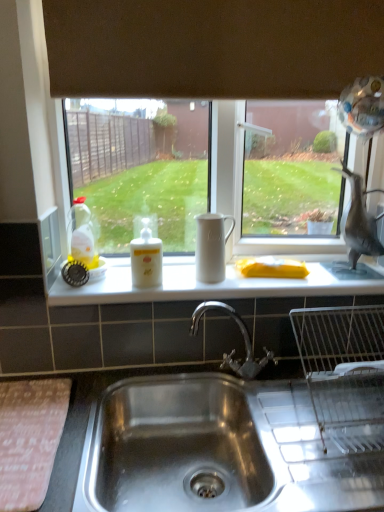
The image size is (384, 512). I want to click on gray matte bird at right, so point(358,221).

Measure the distance between point (353, 227) and camera.

A distance of 1.34 meters exists between point (353, 227) and camera.

This screenshot has width=384, height=512. Describe the element at coordinates (218, 450) in the screenshot. I see `stainless steel sink at lower center` at that location.

Where is `white matte jug at center`? Image resolution: width=384 pixels, height=512 pixels. white matte jug at center is located at coordinates (211, 247).

Would you say gray matte bird at right is inside or outside translucent yellow liquid at bottle left, the 1th bottle viewed from the left?

The correct answer is: outside.

Is gray matte bird at right in contact with translucent yellow liquid at bottle left, the 1th bottle viewed from the left?

There is a gap between gray matte bird at right and translucent yellow liquid at bottle left, the 1th bottle viewed from the left.

Does point (342, 217) appear closer or farther from the camera than point (88, 208)?

Point (342, 217) appears to be closer to the viewer than point (88, 208).

From a real-world perspective, who is located lower, brown matte exhaust hood at upper center or white matte jug at center?

In real-world perspective, white matte jug at center is lower.

Can you confirm if brown matte exhaust hood at upper center is positioned to the left of white matte jug at center?

In fact, brown matte exhaust hood at upper center is to the right of white matte jug at center.

Is brown matte exhaust hood at upper center completely or partially outside of white matte jug at center?

Indeed, brown matte exhaust hood at upper center is completely outside white matte jug at center.

In the image, there is a white matte jug at center. Find the location of `sink below it (from a real-world perspective)`. sink below it (from a real-world perspective) is located at coordinates (218, 450).

Would you say white matte jug at center is part of stainless steel sink at lower center's contents?

No, white matte jug at center is located outside of stainless steel sink at lower center.

Is stainless steel sink at lower center taller or shorter than white matte jug at center?

In the image, stainless steel sink at lower center appears to be taller than white matte jug at center.

From a real-world perspective, between stainless steel sink at lower center and white matte jug at center, who is vertically higher?

white matte jug at center is physically above.

Is there a large distance between translucent yellow liquid at bottle left, the 1th bottle viewed from the left, and gray matte bird at right?

No, there isn't a large distance between translucent yellow liquid at bottle left, the 1th bottle viewed from the left, and gray matte bird at right.

What are the coordinates of `animal above the translucent yellow liquid at bottle left, the 1th bottle viewed from the left (from the image's perspective)` in the screenshot? It's located at (358, 221).

Is translucent yellow liquid at bottle left, the 1th bottle viewed from the left, inside the boundaries of gray matte bird at right, or outside?

translucent yellow liquid at bottle left, the 1th bottle viewed from the left, is located beyond the bounds of gray matte bird at right.

From the image's perspective, is translucent yellow liquid at bottle left, arranged as the second bottle when viewed from the right, over white matte counter top at center?

Yes, from the image's perspective, translucent yellow liquid at bottle left, arranged as the second bottle when viewed from the right, is above white matte counter top at center.

Can you tell me how much translucent yellow liquid at bottle left, arranged as the second bottle when viewed from the right, and white matte counter top at center differ in facing direction?

The angular difference between translucent yellow liquid at bottle left, arranged as the second bottle when viewed from the right, and white matte counter top at center is 0.337 degrees.

This screenshot has height=512, width=384. I want to click on counter top on the right of translucent yellow liquid at bottle left, the 1th bottle viewed from the left, so click(x=218, y=284).

Considering the relative positions of brown matte exhaust hood at upper center and stainless steel sink at lower center in the image provided, is brown matte exhaust hood at upper center to the left of stainless steel sink at lower center from the viewer's perspective?

Yes.

Is brown matte exhaust hood at upper center wider or thinner than stainless steel sink at lower center?

In the image, brown matte exhaust hood at upper center appears to be more narrow than stainless steel sink at lower center.

Based on the photo, from the image's perspective, which object appears higher, brown matte exhaust hood at upper center or stainless steel sink at lower center?

brown matte exhaust hood at upper center is shown above in the image.

From a real-world perspective, is brown matte exhaust hood at upper center physically located above or below stainless steel sink at lower center?

In terms of real-world spatial position, brown matte exhaust hood at upper center is above stainless steel sink at lower center.

Is translucent yellow liquid at bottle left, the 1th bottle viewed from the left, facing away from brown matte exhaust hood at upper center?

translucent yellow liquid at bottle left, the 1th bottle viewed from the left, is not turned away from brown matte exhaust hood at upper center.

From the image's perspective, is translucent yellow liquid at bottle left, arranged as the second bottle when viewed from the right, located beneath brown matte exhaust hood at upper center?

Yes, from the image's perspective, translucent yellow liquid at bottle left, arranged as the second bottle when viewed from the right, is beneath brown matte exhaust hood at upper center.

Which object is positioned more to the left, translucent yellow liquid at bottle left, arranged as the second bottle when viewed from the right, or brown matte exhaust hood at upper center?

translucent yellow liquid at bottle left, arranged as the second bottle when viewed from the right.

Is translucent yellow liquid at bottle left, the 1th bottle viewed from the left, wider than brown matte exhaust hood at upper center?

Correct, the width of translucent yellow liquid at bottle left, the 1th bottle viewed from the left, exceeds that of brown matte exhaust hood at upper center.

From the image's perspective, starting from the gray matte bird at right, which bottle is the 1st one below? Please provide its 2D coordinates.

[(81, 234)]

In the image, there is a brown matte exhaust hood at upper center. At what (x,y) coordinates should I click in order to perform the action: click on jug below it (from a real-world perspective). Please return your answer as a coordinate pair (x, y). Image resolution: width=384 pixels, height=512 pixels. Looking at the image, I should click on (211, 247).

In the scene shown: Considering their positions, is white matte counter top at center positioned further to translucent yellow liquid at bottle left, the 1th bottle viewed from the left, than white matte bottle at center, the 1th bottle in the right-to-left sequence?

white matte counter top at center.

Which object lies nearer to the anchor point translucent yellow liquid at bottle left, the 1th bottle viewed from the left, white matte counter top at center or white matte jug at center?

Based on the image, white matte counter top at center appears to be nearer to translucent yellow liquid at bottle left, the 1th bottle viewed from the left.

Which object lies nearer to the anchor point translucent yellow liquid at bottle left, the 1th bottle viewed from the left, stainless steel sink at lower center or white matte jug at center?

The object closer to translucent yellow liquid at bottle left, the 1th bottle viewed from the left, is white matte jug at center.

Looking at this image, based on their spatial positions, is brown matte exhaust hood at upper center or gray matte bird at right further from stainless steel sink at lower center?

brown matte exhaust hood at upper center is positioned further to the anchor stainless steel sink at lower center.

Based on their spatial positions, is white matte bottle at center, which is counted as the 2th bottle, starting from the left, or translucent yellow liquid at bottle left, the 1th bottle viewed from the left, further from gray matte bird at right?

Based on the image, translucent yellow liquid at bottle left, the 1th bottle viewed from the left, appears to be further to gray matte bird at right.

Considering their positions, is brown matte exhaust hood at upper center positioned further to white matte jug at center than white matte bottle at center, the 1th bottle in the right-to-left sequence?

brown matte exhaust hood at upper center lies further to white matte jug at center than the other object.

Considering their positions, is white matte jug at center positioned further to brown matte exhaust hood at upper center than white matte counter top at center?

The object further to brown matte exhaust hood at upper center is white matte counter top at center.

Estimate the real-world distances between objects in this image. Which object is closer to white matte jug at center, gray matte bird at right or white matte bottle at center, the 1th bottle in the right-to-left sequence?

Among the two, white matte bottle at center, the 1th bottle in the right-to-left sequence, is located nearer to white matte jug at center.

I want to click on counter top between white matte bottle at center, the 1th bottle in the right-to-left sequence, and gray matte bird at right, so click(218, 284).

This screenshot has height=512, width=384. I want to click on counter top positioned between stainless steel sink at lower center and gray matte bird at right from near to far, so click(218, 284).

Find the location of a particular element. This screenshot has width=384, height=512. jug located between stainless steel sink at lower center and translucent yellow liquid at bottle left, arranged as the second bottle when viewed from the right, in the depth direction is located at coordinates (211, 247).

Identify the location of bottle between translucent yellow liquid at bottle left, the 1th bottle viewed from the left, and gray matte bird at right, in the horizontal direction. The height and width of the screenshot is (512, 384). (146, 258).